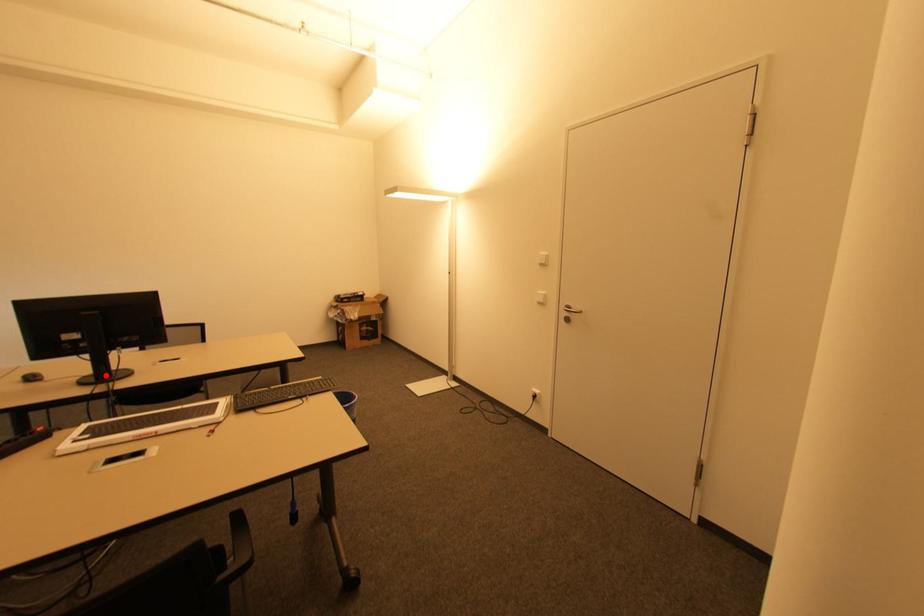
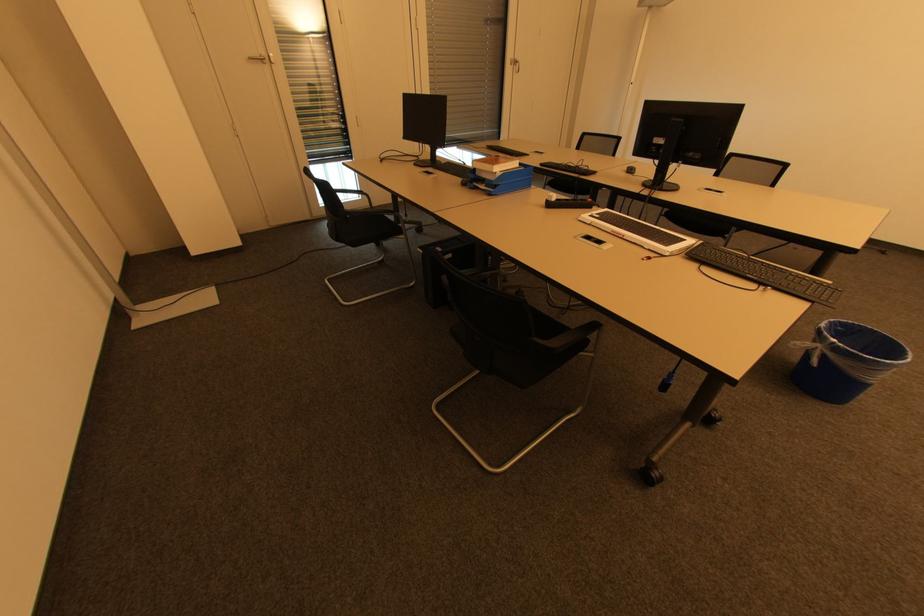
In the second image, find the point that corresponds to the highlighted location in the first image.

(660, 183)